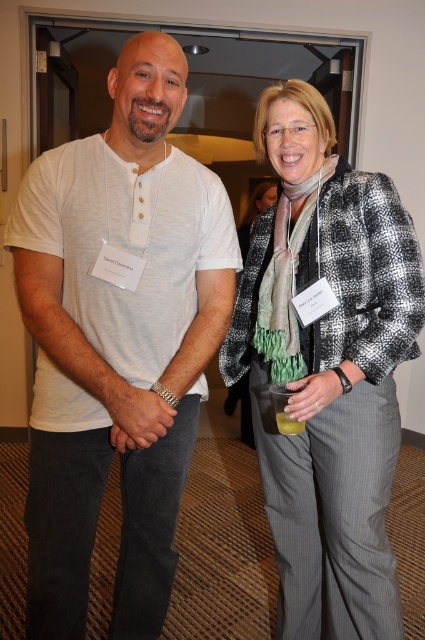
Question: Can you confirm if white cotton t-shirt at center is positioned above black and white checkered jacket at center?

Choices:
 (A) no
 (B) yes

Answer: (B)

Question: Is white cotton t-shirt at center positioned before black and white checkered jacket at center?

Choices:
 (A) yes
 (B) no

Answer: (A)

Question: Does white cotton t-shirt at center have a larger size compared to black and white checkered jacket at center?

Choices:
 (A) yes
 (B) no

Answer: (B)

Question: Which point is closer to the camera?

Choices:
 (A) (407, 262)
 (B) (50, 442)

Answer: (B)

Question: Among these objects, which one is nearest to the camera?

Choices:
 (A) black and white checkered jacket at center
 (B) white cotton t-shirt at center

Answer: (B)